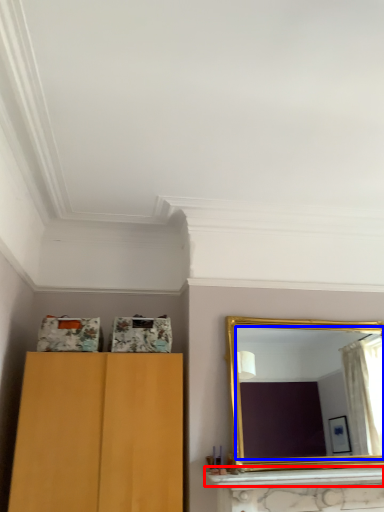
Question: Which object is closer to the camera taking this photo, mantle (highlighted by a red box) or mirror (highlighted by a blue box)?

Choices:
 (A) mantle
 (B) mirror

Answer: (A)